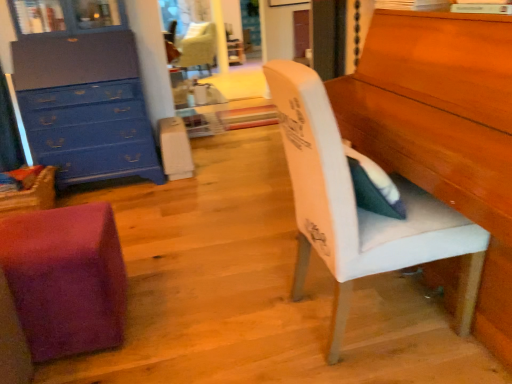
Question: Should I look upward or downward to see purple fuzzy cube at lower left, which is the 3th chair from top to bottom?

Choices:
 (A) down
 (B) up

Answer: (A)

Question: Does purple fuzzy cube at lower left, the 2th chair when ordered from left to right, appear on the right side of blue painted wood chest of drawers at upper left?

Choices:
 (A) no
 (B) yes

Answer: (B)

Question: Is purple fuzzy cube at lower left, which is the 3th chair from top to bottom, oriented away from blue painted wood chest of drawers at upper left?

Choices:
 (A) no
 (B) yes

Answer: (A)

Question: Is purple fuzzy cube at lower left, which is the 3th chair from top to bottom, next to blue painted wood chest of drawers at upper left?

Choices:
 (A) yes
 (B) no

Answer: (B)

Question: From the image's perspective, is purple fuzzy cube at lower left, which is the 3th chair from top to bottom, located above blue painted wood chest of drawers at upper left?

Choices:
 (A) yes
 (B) no

Answer: (B)

Question: Considering the relative sizes of purple fuzzy cube at lower left, placed as the second chair when sorted from back to front, and blue painted wood chest of drawers at upper left in the image provided, is purple fuzzy cube at lower left, placed as the second chair when sorted from back to front, bigger than blue painted wood chest of drawers at upper left?

Choices:
 (A) no
 (B) yes

Answer: (A)

Question: Is purple fuzzy cube at lower left, arranged as the second chair when viewed from the front, shorter than blue painted wood chest of drawers at upper left?

Choices:
 (A) no
 (B) yes

Answer: (B)

Question: From a real-world perspective, does blue painted wood chest of drawers at upper left sit lower than purple fuzzy cube at lower left, placed as the second chair when sorted from back to front?

Choices:
 (A) no
 (B) yes

Answer: (A)

Question: Is blue painted wood chest of drawers at upper left taller than purple fuzzy cube at lower left, which is counted as the second chair, starting from the right?

Choices:
 (A) no
 (B) yes

Answer: (B)

Question: Can you confirm if blue painted wood chest of drawers at upper left is smaller than purple fuzzy cube at lower left, which is the 3th chair from top to bottom?

Choices:
 (A) yes
 (B) no

Answer: (B)

Question: Could you tell me if blue painted wood chest of drawers at upper left is turned towards purple fuzzy cube at lower left, the 2th chair when ordered from left to right?

Choices:
 (A) no
 (B) yes

Answer: (B)

Question: Is blue painted wood chest of drawers at upper left at the left side of purple fuzzy cube at lower left, the 2th chair when ordered from left to right?

Choices:
 (A) no
 (B) yes

Answer: (B)

Question: Considering the relative sizes of blue painted wood chest of drawers at upper left and purple fuzzy cube at lower left, the 2th chair when ordered from left to right, in the image provided, is blue painted wood chest of drawers at upper left bigger than purple fuzzy cube at lower left, the 2th chair when ordered from left to right,?

Choices:
 (A) no
 (B) yes

Answer: (B)

Question: From the image's perspective, is velvet cream chair at upper center, the third chair positioned from the front, located above purple fuzzy cube at lower left, which ranks as the first chair in bottom-to-top order?

Choices:
 (A) yes
 (B) no

Answer: (A)